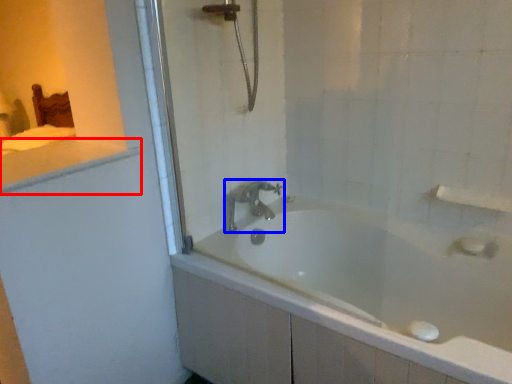
Question: Among these objects, which one is nearest to the camera, counter top (highlighted by a red box) or tap (highlighted by a blue box)?

Choices:
 (A) counter top
 (B) tap

Answer: (A)